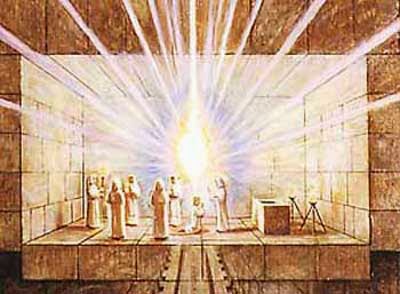
Image resolution: width=400 pixels, height=294 pixels. Identify the location of beam. (224, 121).